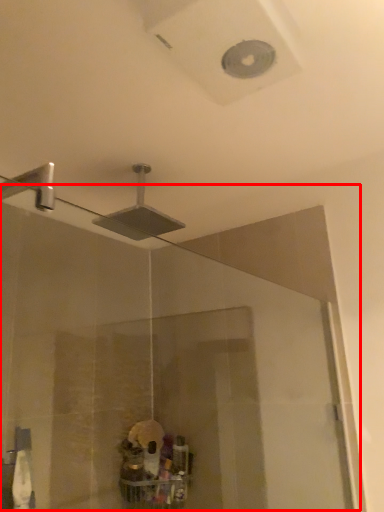
Question: From the image's perspective, where is glass door (annotated by the red box) located relative to shower?

Choices:
 (A) above
 (B) below

Answer: (B)